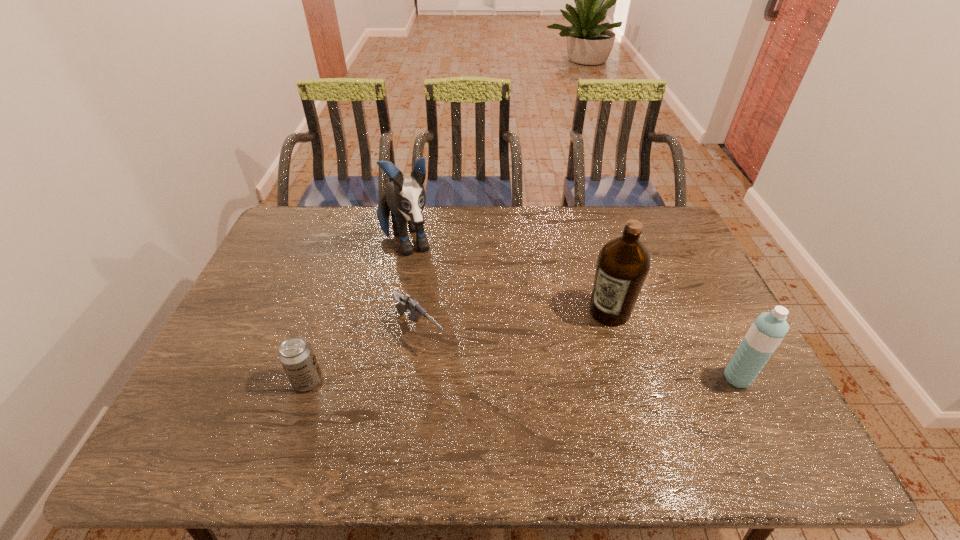
The image size is (960, 540). In order to click on vacant area between the leftmost object and the farthest object in this screenshot , I will do `click(357, 312)`.

This screenshot has width=960, height=540. What are the coordinates of `vacant area between the second object from right to left and the beer can` in the screenshot? It's located at (459, 346).

The height and width of the screenshot is (540, 960). I want to click on free point between the leftmost object and the gun, so click(364, 356).

Locate an element on the screen. The height and width of the screenshot is (540, 960). blank region between the beer can and the farthest object is located at coordinates (357, 312).

At what (x,y) coordinates should I click in order to perform the action: click on free spot between the beer can and the third shortest object. Please return your answer as a coordinate pair (x, y). Looking at the image, I should click on (522, 380).

Identify the location of empty space between the leftmost object and the shortest object. The height and width of the screenshot is (540, 960). (364, 356).

Locate an element on the screen. This screenshot has height=540, width=960. empty space between the olive oil and the tallest object is located at coordinates (508, 278).

Where is `free space between the farthest object and the shortest object`? The width and height of the screenshot is (960, 540). free space between the farthest object and the shortest object is located at coordinates (413, 288).

Where is `vacant area that lies between the gun and the beer can`? The height and width of the screenshot is (540, 960). vacant area that lies between the gun and the beer can is located at coordinates (364, 356).

Locate which object ranks in proximity to the leftmost object. Please provide its 2D coordinates. Your answer should be formatted as a tuple, i.e. [(x, y)], where the tuple contains the x and y coordinates of a point satisfying the conditions above.

[(406, 303)]